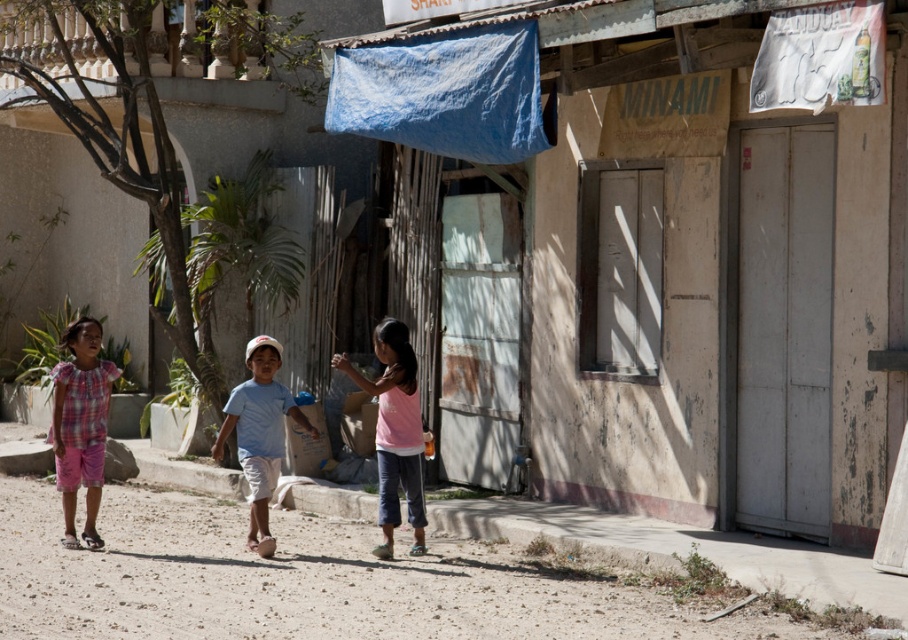
You are standing at the point with coordinates (x=447, y=93) in the image. What object are you standing on?

The point with coordinates (x=447, y=93) is on the blue fabric tarp at upper center.